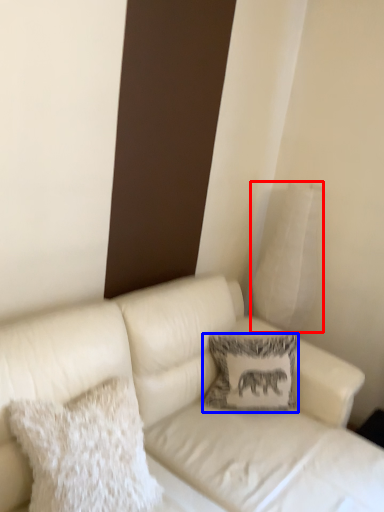
Question: Among these objects, which one is nearest to the camera, pillow (highlighted by a red box) or pillow (highlighted by a blue box)?

Choices:
 (A) pillow
 (B) pillow

Answer: (B)